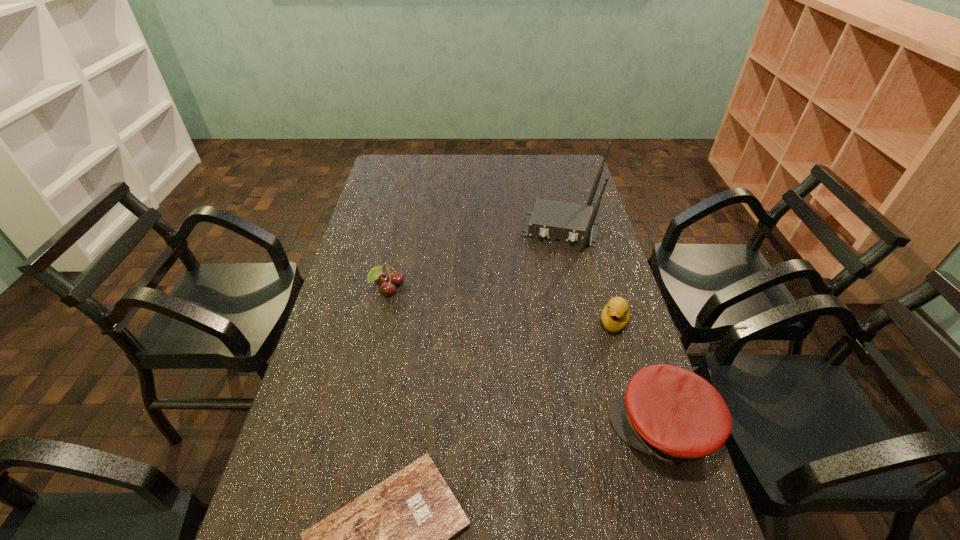
Where is `duckling that is at the right edge`? duckling that is at the right edge is located at coordinates (615, 316).

In the image, there is a desktop. Where is `vacant space at the far edge`? The image size is (960, 540). vacant space at the far edge is located at coordinates (451, 168).

You are a GUI agent. You are given a task and a screenshot of the screen. Output one action in this format:
    pyautogui.click(x=<x>, y=<y>)
    Task: Click on the vacant space at the near edge
    
    Given the screenshot: What is the action you would take?
    pyautogui.click(x=474, y=528)

In the image, there is a desktop. Identify the location of blank space at the left edge. (338, 376).

The width and height of the screenshot is (960, 540). I want to click on vacant point at the far left corner, so click(x=413, y=174).

This screenshot has width=960, height=540. Identify the location of free space at the far right corner of the desktop. point(576,178).

The image size is (960, 540). Find the location of `empty location between the cap and the second farthest object`. empty location between the cap and the second farthest object is located at coordinates (526, 359).

Find the location of a particular element. This screenshot has height=540, width=960. free space between the second farthest object and the cap is located at coordinates (526, 359).

Identify which object is the fourth closest to the tallest object. Please provide its 2D coordinates. Your answer should be formatted as a tuple, i.e. [(x, y)], where the tuple contains the x and y coordinates of a point satisfying the conditions above.

[(396, 539)]

Find the location of a particular element. the fourth closest object relative to the cap is located at coordinates (376, 274).